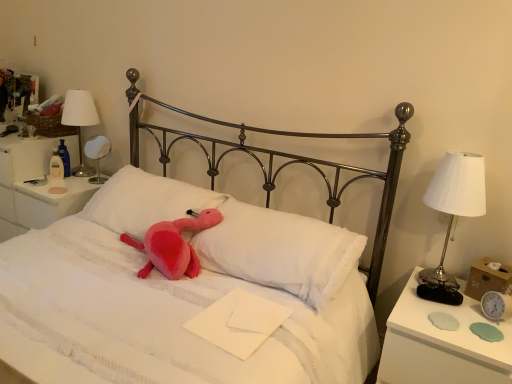
What are the coordinates of `fluffy pink pillow at center, which is the 1th pillow from left to right` in the screenshot? It's located at (145, 201).

The height and width of the screenshot is (384, 512). What do you see at coordinates (34, 187) in the screenshot? I see `white plastic nightstand at left, the second nightstand positioned from the front` at bounding box center [34, 187].

Find the location of a particular element. Image resolution: width=512 pixels, height=384 pixels. white fabric lampshade at right, acting as the 3th bedside lamp starting from the back is located at coordinates (452, 215).

In order to click on matte silver mirror at left, which is the 2th bedside lamp from right to left in this screenshot , I will do `click(97, 155)`.

This screenshot has height=384, width=512. In order to click on the 1st pillow positioned above the white glossy nightstand at right, acting as the 1th nightstand starting from the bottom (from a real-world perspective) in this screenshot , I will do `click(280, 250)`.

Can you tell me how much white glossy nightstand at right, the second nightstand from the top, and white soft pillow at center, acting as the first pillow starting from the right, differ in facing direction?

→ The angle between the facing direction of white glossy nightstand at right, the second nightstand from the top, and the facing direction of white soft pillow at center, acting as the first pillow starting from the right, is 4.48 degrees.

From a real-world perspective, which is physically above, white glossy nightstand at right, which ranks as the 2th nightstand in left-to-right order, or white soft pillow at center, acting as the first pillow starting from the right?

white soft pillow at center, acting as the first pillow starting from the right.

Looking at this image, does white glossy nightstand at right, the 1th nightstand when ordered from front to back, have a lesser height compared to white soft pillow at center, acting as the first pillow starting from the right?

No.

From a real-world perspective, relative to white fabric lampshade at upper left, the 3th bedside lamp from the right, is white glossy nightstand at right, the second nightstand when ordered from back to front, vertically above or below?

white glossy nightstand at right, the second nightstand when ordered from back to front, is situated lower than white fabric lampshade at upper left, the 3th bedside lamp from the right, in the real world.

From the image's perspective, which nightstand is the 2nd one below the white fabric lampshade at upper left, the 3th bedside lamp from the right? Please provide its 2D coordinates.

[(441, 344)]

Do you think white glossy nightstand at right, the 1th nightstand when ordered from front to back, is within white fabric lampshade at upper left, the 1th bedside lamp in the left-to-right sequence, or outside of it?

white glossy nightstand at right, the 1th nightstand when ordered from front to back, cannot be found inside white fabric lampshade at upper left, the 1th bedside lamp in the left-to-right sequence.

From the image's perspective, which one is positioned higher, white glossy nightstand at right, acting as the 1th nightstand starting from the bottom, or white fabric lampshade at upper left, the 2th bedside lamp in the back-to-front sequence?

white fabric lampshade at upper left, the 2th bedside lamp in the back-to-front sequence.

Is pink plush toy at center next to white plastic nightstand at left, the first nightstand from the back?

They are not placed beside each other.

What's the angular difference between pink plush toy at center and white plastic nightstand at left, the second nightstand positioned from the front,'s facing directions?

8.38 degrees.

From the picture: Is pink plush toy at center closer to the viewer compared to white plastic nightstand at left, the second nightstand positioned from the front?

Yes.

Considering the sizes of pink plush toy at center and white plastic nightstand at left, placed as the second nightstand when sorted from right to left, in the image, is pink plush toy at center taller or shorter than white plastic nightstand at left, placed as the second nightstand when sorted from right to left,?

Considering their sizes, pink plush toy at center has less height than white plastic nightstand at left, placed as the second nightstand when sorted from right to left.

Is fluffy pink pillow at center, which is the 1th pillow from left to right, completely or partially inside silver metallic clock at right?

No.

From the picture: Which object is further away from the camera, silver metallic clock at right or fluffy pink pillow at center, which is the 1th pillow from left to right?

fluffy pink pillow at center, which is the 1th pillow from left to right.

Is silver metallic clock at right positioned far away from fluffy pink pillow at center, which is the 1th pillow from left to right?

Yes, silver metallic clock at right and fluffy pink pillow at center, which is the 1th pillow from left to right, are located far from each other.

Considering the positions of objects silver metallic clock at right and fluffy pink pillow at center, the second pillow from the right, in the image provided, who is more to the left, silver metallic clock at right or fluffy pink pillow at center, the second pillow from the right,?

Positioned to the left is fluffy pink pillow at center, the second pillow from the right.

Considering the sizes of pink plush toy at center and white soft pillow at center, the 2th pillow from the left, in the image, is pink plush toy at center bigger or smaller than white soft pillow at center, the 2th pillow from the left,?

Considering their sizes, pink plush toy at center takes up less space than white soft pillow at center, the 2th pillow from the left.

Which is behind, point (153, 251) or point (227, 257)?

Point (153, 251)

Where is `pillow lying below the pink plush toy at center (from the image's perspective)`? This screenshot has width=512, height=384. pillow lying below the pink plush toy at center (from the image's perspective) is located at coordinates (280, 250).

Would you say pink plush toy at center is a long distance from white soft pillow at center, the 2th pillow from the left?

Actually, pink plush toy at center and white soft pillow at center, the 2th pillow from the left, are a little close together.

I want to click on pillow located behind the silver metallic clock at right, so click(145, 201).

Which object is further away from the camera taking this photo, fluffy pink pillow at center, the second pillow from the right, or silver metallic clock at right?

fluffy pink pillow at center, the second pillow from the right, is further away from the camera.

Are fluffy pink pillow at center, which is the 1th pillow from left to right, and silver metallic clock at right located far from each other?

Yes.

Considering the positions of objects fluffy pink pillow at center, which is the 1th pillow from left to right, and silver metallic clock at right in the image provided, who is more to the right, fluffy pink pillow at center, which is the 1th pillow from left to right, or silver metallic clock at right?

From the viewer's perspective, silver metallic clock at right appears more on the right side.

Is point (364, 377) positioned in front of point (408, 351)?

No.

Visually, is pink plush toy at center positioned to the left or to the right of white glossy nightstand at right, acting as the 1th nightstand starting from the bottom?

Based on their positions, pink plush toy at center is located to the left of white glossy nightstand at right, acting as the 1th nightstand starting from the bottom.

This screenshot has height=384, width=512. In order to click on the 2nd nightstand located beneath the pink plush toy at center (from a real-world perspective) in this screenshot , I will do coord(441,344).

Is pink plush toy at center positioned beyond the bounds of white glossy nightstand at right, which is counted as the 1th nightstand, starting from the right?

That's correct, pink plush toy at center is outside of white glossy nightstand at right, which is counted as the 1th nightstand, starting from the right.

From the white glossy nightstand at right, acting as the 1th nightstand starting from the bottom, count the 1st pillow to the left and point to it. Please provide its 2D coordinates.

[(280, 250)]

Where is `the 2nd nightstand below the white fabric lampshade at upper left, which is the second bedside lamp in front-to-back order (from the image's perspective)`? The image size is (512, 384). the 2nd nightstand below the white fabric lampshade at upper left, which is the second bedside lamp in front-to-back order (from the image's perspective) is located at coordinates (441, 344).

When comparing their distances from matte silver mirror at left, which is the 2th bedside lamp from right to left, does white soft pillow at center, the 2th pillow from the left, or fluffy pink pillow at center, the second pillow from the right, seem closer?

The object closer to matte silver mirror at left, which is the 2th bedside lamp from right to left, is fluffy pink pillow at center, the second pillow from the right.

Which object lies further to the anchor point white plastic nightstand at left, the first nightstand in the top-to-bottom sequence, fluffy pink pillow at center, the second pillow from the right, or pink plush toy at center?

pink plush toy at center lies further to white plastic nightstand at left, the first nightstand in the top-to-bottom sequence, than the other object.

From the image, which object appears to be farther from white fabric lampshade at right, acting as the 3th bedside lamp starting from the back, pink plush toy at center or matte silver mirror at left, the third bedside lamp when ordered from front to back?

matte silver mirror at left, the third bedside lamp when ordered from front to back, is positioned further to the anchor white fabric lampshade at right, acting as the 3th bedside lamp starting from the back.

When comparing their distances from white soft pillow at center, the 2th pillow from the left, does matte silver mirror at left, the third bedside lamp when ordered from front to back, or silver metallic clock at right seem further?

matte silver mirror at left, the third bedside lamp when ordered from front to back.

Which object lies further to the anchor point silver metallic clock at right, white fabric lampshade at upper left, the 1th bedside lamp in the left-to-right sequence, or pink plush toy at center?

The object further to silver metallic clock at right is white fabric lampshade at upper left, the 1th bedside lamp in the left-to-right sequence.

From the picture: Estimate the real-world distances between objects in this image. Which object is further from white plastic nightstand at left, arranged as the 2th nightstand when ordered from the bottom, pink plush toy at center or silver metallic clock at right?

The object further to white plastic nightstand at left, arranged as the 2th nightstand when ordered from the bottom, is silver metallic clock at right.

Based on their spatial positions, is fluffy pink pillow at center, which is the 1th pillow from left to right, or pink plush toy at center further from white soft pillow at center, the 2th pillow from the left?

fluffy pink pillow at center, which is the 1th pillow from left to right, lies further to white soft pillow at center, the 2th pillow from the left, than the other object.

Estimate the real-world distances between objects in this image. Which object is closer to pink plush toy at center, white fabric lampshade at upper left, the 3th bedside lamp from the right, or pink plush toy at center?

The object closer to pink plush toy at center is pink plush toy at center.

Locate an element on the screen. pillow situated between fluffy pink pillow at center, the second pillow from the right, and white glossy nightstand at right, the 1th nightstand when ordered from front to back, from left to right is located at coordinates (280, 250).

Where is `baby elephant between pink plush toy at center and matte silver mirror at left, the first bedside lamp in the back-to-front sequence, along the z-axis`? The width and height of the screenshot is (512, 384). baby elephant between pink plush toy at center and matte silver mirror at left, the first bedside lamp in the back-to-front sequence, along the z-axis is located at coordinates (173, 245).

The image size is (512, 384). In order to click on baby elephant between white fabric lampshade at upper left, the 1th bedside lamp in the left-to-right sequence, and silver metallic clock at right in this screenshot , I will do `click(173, 245)`.

Find the location of `pillow between white fabric lampshade at upper left, which is the second bedside lamp in front-to-back order, and white soft pillow at center, the 2th pillow from the left, from left to right`. pillow between white fabric lampshade at upper left, which is the second bedside lamp in front-to-back order, and white soft pillow at center, the 2th pillow from the left, from left to right is located at coordinates (145, 201).